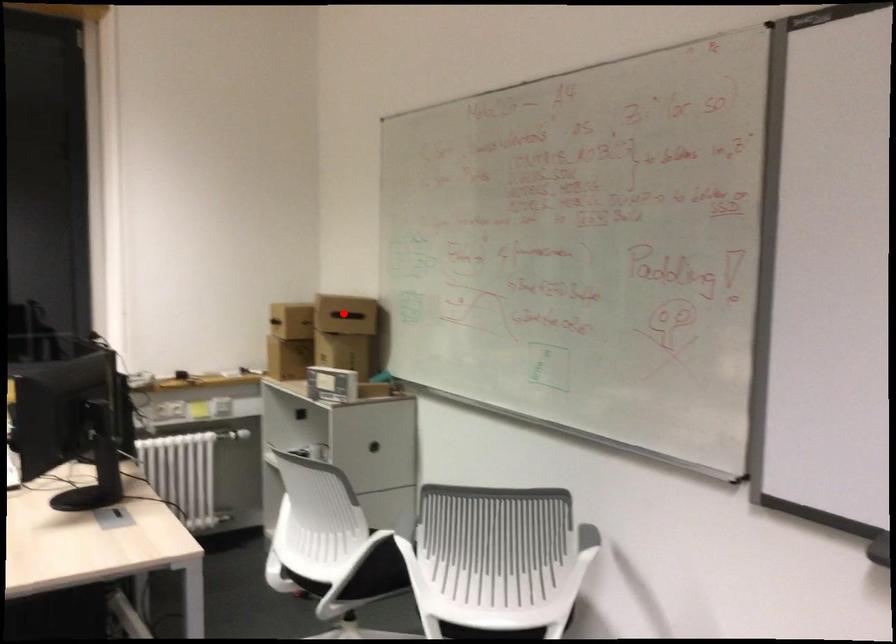
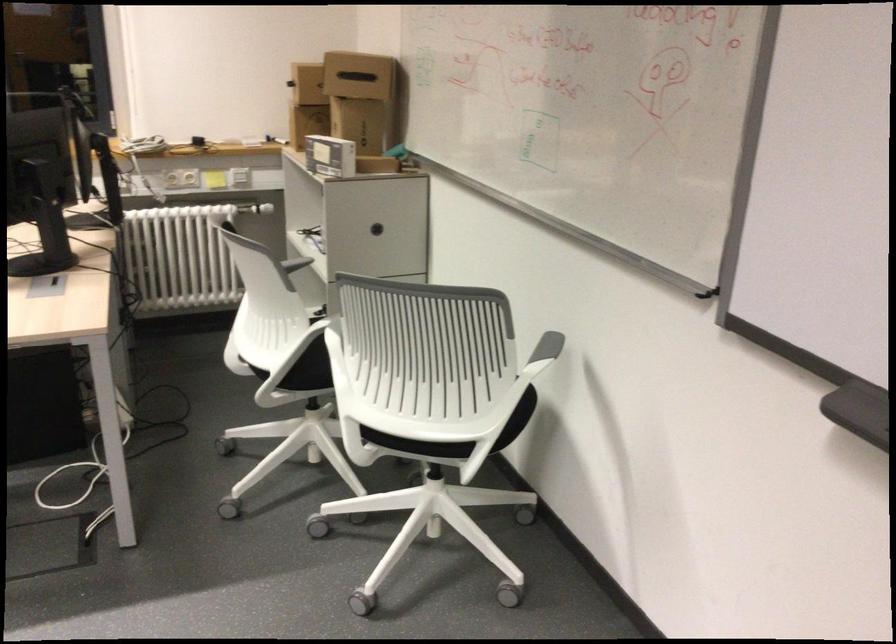
Locate, in the second image, the point that corresponds to the highlighted location in the first image.

(358, 75)